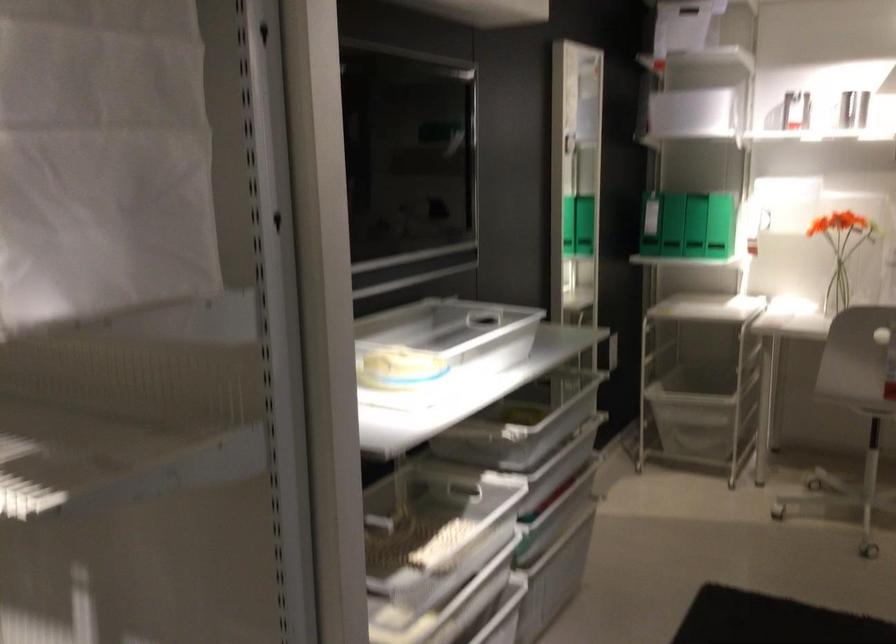
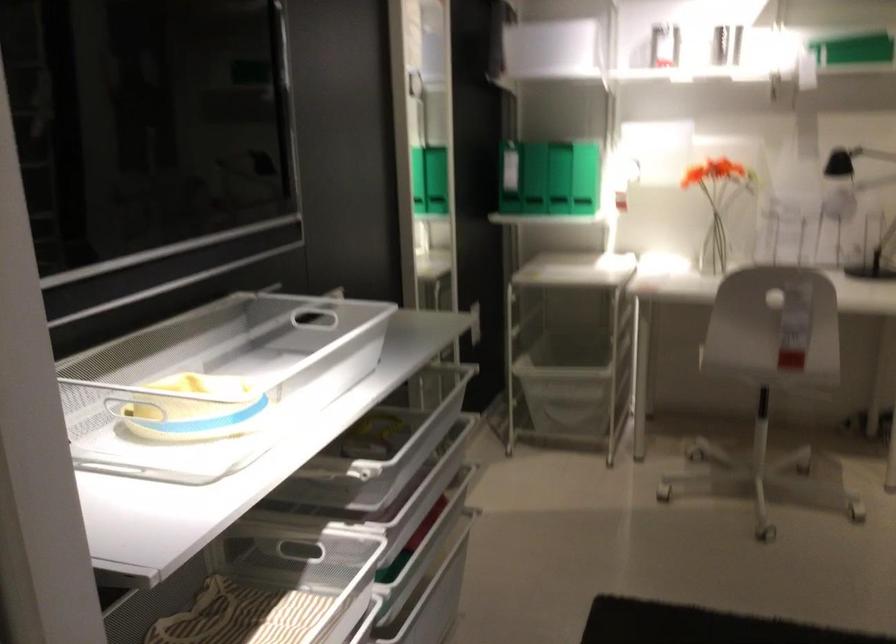
In the second image, find the point that corresponds to point 722,213 in the first image.

(558, 178)